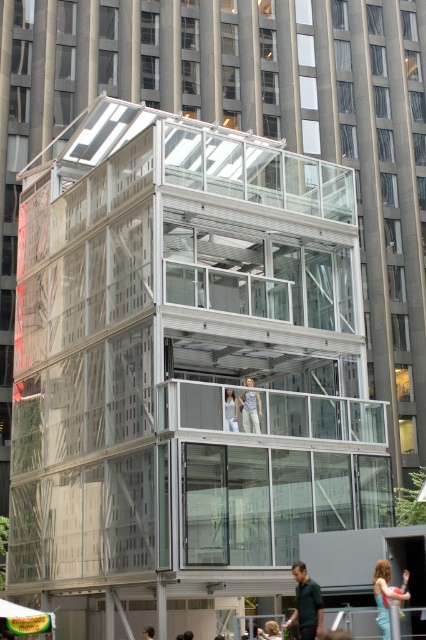
You are a tailor trying to determine which pair of pants to recommend to a customer who needs a wider fit. Based on the image, can you suggest which between the light blue jeans at center and the light beige fabric pants at center would be more suitable?

The light blue jeans at center might be wider than light beige fabric pants at center, so they could be the better choice for a wider fit.